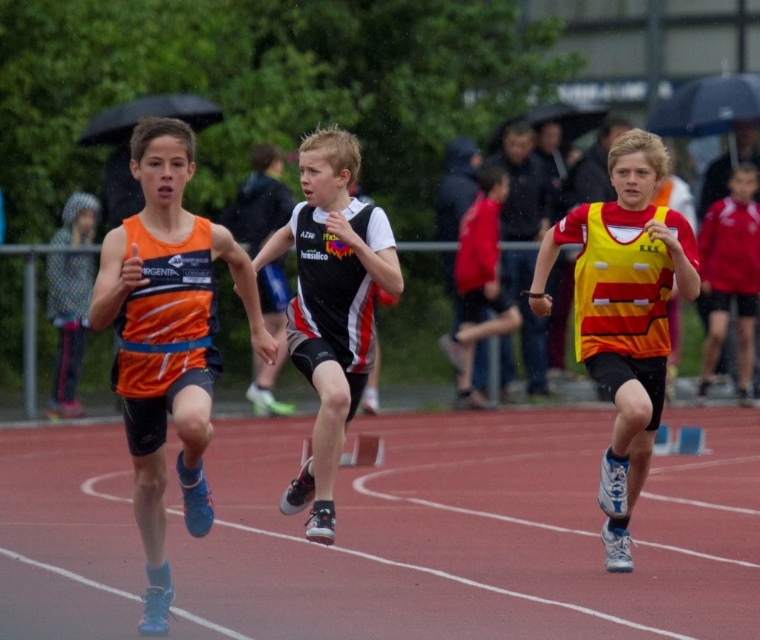
Which is below, yellow/red striped vest at center or black and white jersey at center?

yellow/red striped vest at center

Does yellow/red striped vest at center appear on the left side of black and white jersey at center?

No, yellow/red striped vest at center is not to the left of black and white jersey at center.

You are a GUI agent. You are given a task and a screenshot of the screen. Output one action in this format:
    pyautogui.click(x=<x>, y=<y>)
    Task: Click on the yellow/red striped vest at center
    The height and width of the screenshot is (640, 760).
    Given the screenshot: What is the action you would take?
    pyautogui.click(x=624, y=314)

Does red rubber track at center have a lesser width compared to black and white jersey at center?

In fact, red rubber track at center might be wider than black and white jersey at center.

Does red rubber track at center have a smaller size compared to black and white jersey at center?

No, red rubber track at center is not smaller than black and white jersey at center.

What do you see at coordinates (475, 536) in the screenshot? This screenshot has width=760, height=640. I see `red rubber track at center` at bounding box center [475, 536].

You are a GUI agent. You are given a task and a screenshot of the screen. Output one action in this format:
    pyautogui.click(x=<x>, y=<y>)
    Task: Click on the red rubber track at center
    
    Given the screenshot: What is the action you would take?
    pyautogui.click(x=475, y=536)

Which is more to the right, red rubber track at center or yellow/red striped vest at center?

From the viewer's perspective, yellow/red striped vest at center appears more on the right side.

Is red rubber track at center to the right of yellow/red striped vest at center from the viewer's perspective?

In fact, red rubber track at center is to the left of yellow/red striped vest at center.

Describe the element at coordinates (475, 536) in the screenshot. I see `red rubber track at center` at that location.

Identify the location of red rubber track at center. The height and width of the screenshot is (640, 760). (475, 536).